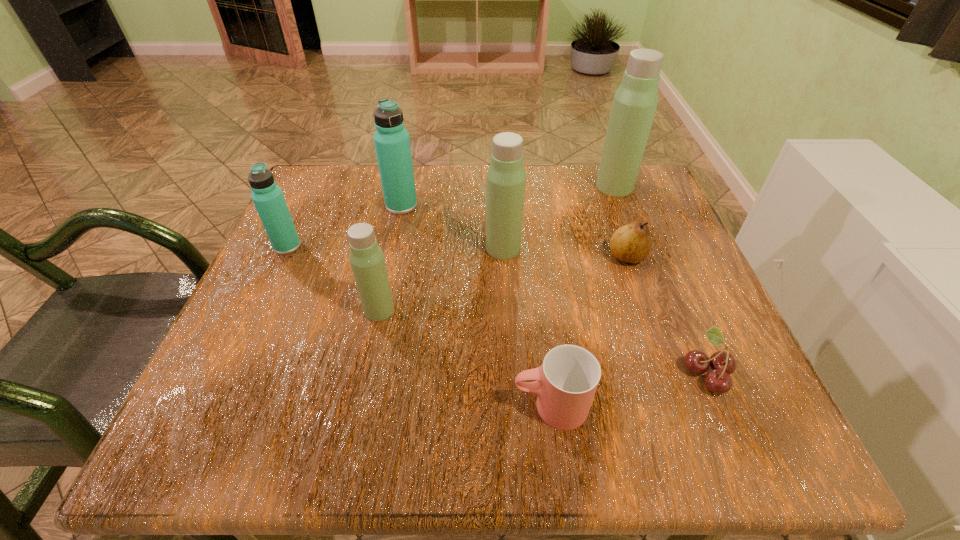
At what (x,y) coordinates should I click in order to perform the action: click on the tallest thermos bottle. Please return your answer as a coordinate pair (x, y). Looking at the image, I should click on (634, 105).

The width and height of the screenshot is (960, 540). Find the location of `the biggest light thermos bottle`. the biggest light thermos bottle is located at coordinates (634, 105).

You are a GUI agent. You are given a task and a screenshot of the screen. Output one action in this format:
    pyautogui.click(x=<x>, y=<y>)
    Task: Click on the right aqua thermos bottle
    
    Given the screenshot: What is the action you would take?
    pyautogui.click(x=392, y=143)

At what (x,y) coordinates should I click in order to perform the action: click on the bigger aqua thermos bottle. Please return your answer as a coordinate pair (x, y). This screenshot has height=540, width=960. Looking at the image, I should click on (392, 143).

Locate an element on the screen. The width and height of the screenshot is (960, 540). the second smallest light thermos bottle is located at coordinates (506, 178).

Where is `the fourth thermos bottle from left to right`? The image size is (960, 540). the fourth thermos bottle from left to right is located at coordinates (506, 178).

The width and height of the screenshot is (960, 540). I want to click on the left aqua thermos bottle, so click(268, 198).

At what (x,y) coordinates should I click in order to perform the action: click on the leftmost object. Please return your answer as a coordinate pair (x, y). This screenshot has height=540, width=960. Looking at the image, I should click on (268, 198).

The width and height of the screenshot is (960, 540). Find the location of `the nearest thermos bottle`. the nearest thermos bottle is located at coordinates (366, 258).

The image size is (960, 540). Identify the location of the nearest light thermos bottle. (366, 258).